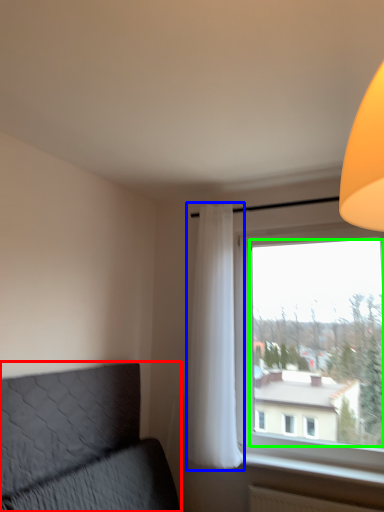
Question: Estimate the real-world distances between objects in this image. Which object is closer to furniture (highlighted by a red box), curtain (highlighted by a blue box) or window screen (highlighted by a green box)?

Choices:
 (A) curtain
 (B) window screen

Answer: (A)